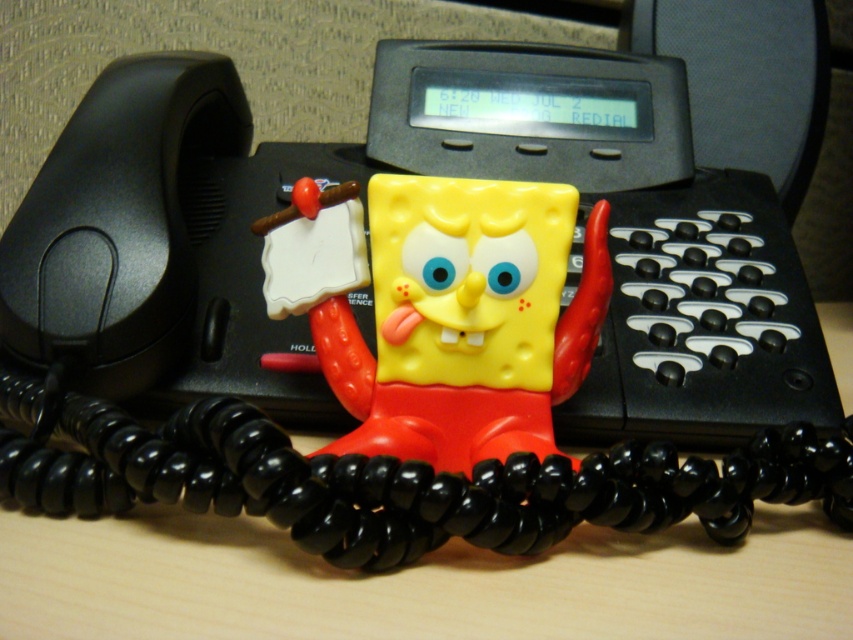
Between point (665, 285) and point (392, 353), which one is positioned in front?

Positioned in front is point (392, 353).

Is black plastic phone at center closer to camera compared to yellow matte sponge at center?

That is False.

The width and height of the screenshot is (853, 640). Describe the element at coordinates (165, 243) in the screenshot. I see `black plastic phone at center` at that location.

In order to click on black plastic phone at center in this screenshot , I will do `click(165, 243)`.